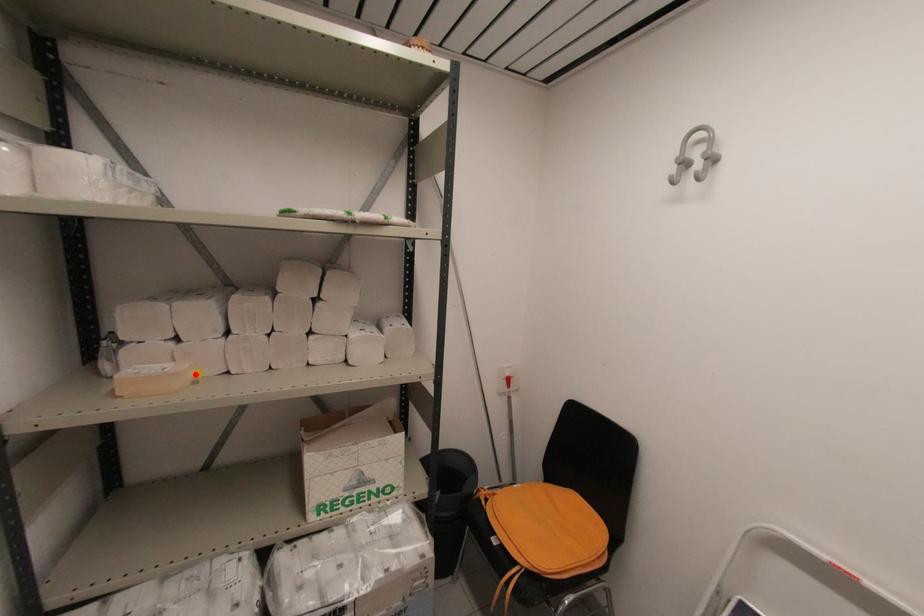
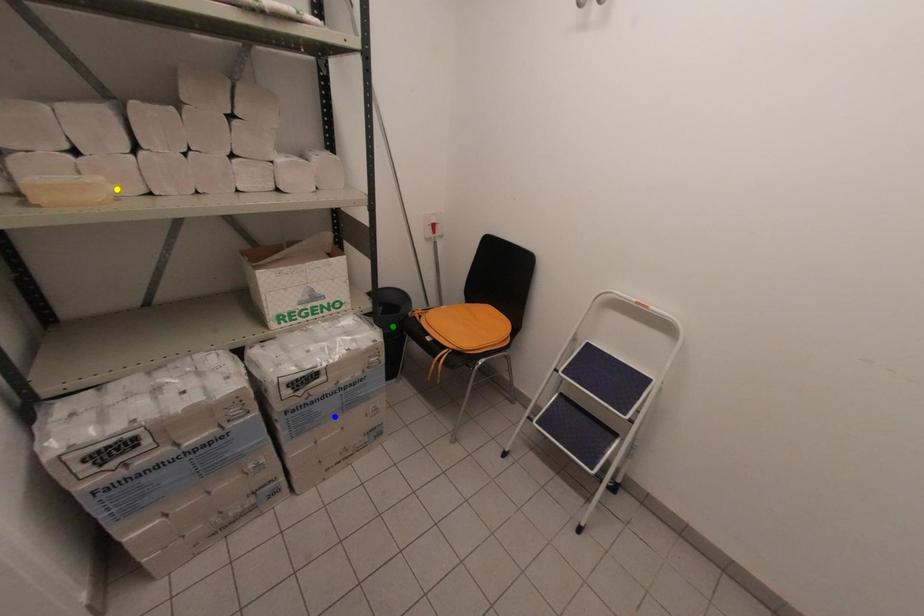
Question: I am providing you with two images of the same scene from different viewpoints. A red point is marked on the first image. You are given multiple points on the second image. In image 2, which mark is for the same physical point as the one in image 1?

Choices:
 (A) yellow point
 (B) blue point
 (C) green point

Answer: (A)